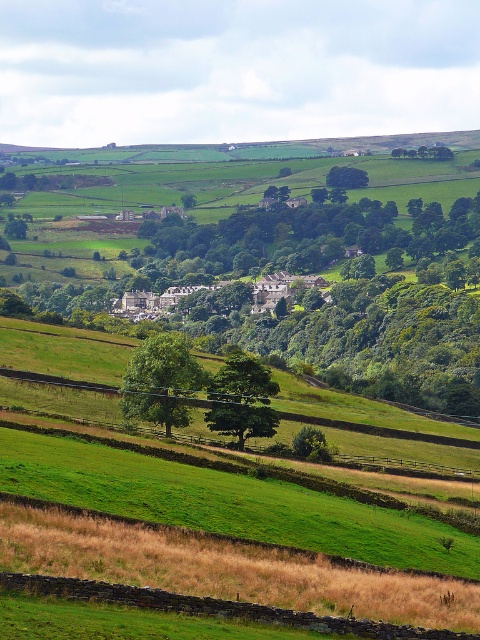
Looking at this image, which is more to the right, stone houses at center or green leafy tree at upper center?

green leafy tree at upper center is more to the right.

Can you confirm if stone houses at center is taller than green leafy tree at upper center?

Indeed, stone houses at center has a greater height compared to green leafy tree at upper center.

Between point (146, 307) and point (347, 180), which one is positioned behind?

The point (347, 180) is behind.

Image resolution: width=480 pixels, height=640 pixels. Identify the location of stone houses at center. [169, 296].

Is green leafy tree at lower center bigger than green leafy tree at center?

Correct, green leafy tree at lower center is larger in size than green leafy tree at center.

Image resolution: width=480 pixels, height=640 pixels. What are the coordinates of `green leafy tree at lower center` in the screenshot? It's located at pyautogui.click(x=162, y=380).

Is point (130, 384) closer to camera compared to point (252, 413)?

Yes, it is in front of point (252, 413).

Find the location of a particular element. The width and height of the screenshot is (480, 640). green leafy tree at lower center is located at coordinates (162, 380).

Is green leafy tree at lower center above stone houses at center?

Actually, green leafy tree at lower center is below stone houses at center.

Who is lower down, green leafy tree at lower center or stone houses at center?

green leafy tree at lower center is below.

This screenshot has width=480, height=640. I want to click on green leafy tree at lower center, so click(162, 380).

Identify the location of green leafy tree at lower center. (162, 380).